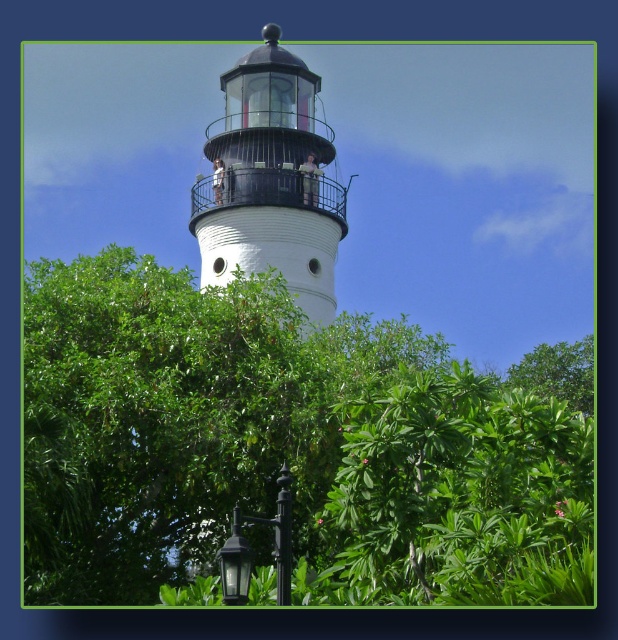
From the picture: Between green leafy tree at center and white matte/lightweight tower at center, which one is positioned higher?

Positioned higher is white matte/lightweight tower at center.

Which is more to the right, green leafy tree at center or white matte/lightweight tower at center?

Positioned to the right is green leafy tree at center.

Who is more distant from viewer, (269, 323) or (250, 116)?

The point (250, 116) is more distant.

At what (x,y) coordinates should I click in order to perform the action: click on green leafy tree at center. Please return your answer as a coordinate pair (x, y). The width and height of the screenshot is (618, 640). Looking at the image, I should click on (289, 444).

How distant is green leafy tree at center from black metal/texture lamp post at lower center?

green leafy tree at center and black metal/texture lamp post at lower center are 32.84 feet apart from each other.

The image size is (618, 640). What do you see at coordinates (289, 444) in the screenshot?
I see `green leafy tree at center` at bounding box center [289, 444].

This screenshot has width=618, height=640. Identify the location of green leafy tree at center. (289, 444).

Is white matte/lightweight tower at center wider than black metal/texture lamp post at lower center?

Yes, white matte/lightweight tower at center is wider than black metal/texture lamp post at lower center.

Who is positioned more to the right, white matte/lightweight tower at center or black metal/texture lamp post at lower center?

black metal/texture lamp post at lower center is more to the right.

What do you see at coordinates (271, 180) in the screenshot? The image size is (618, 640). I see `white matte/lightweight tower at center` at bounding box center [271, 180].

This screenshot has height=640, width=618. I want to click on white matte/lightweight tower at center, so click(x=271, y=180).